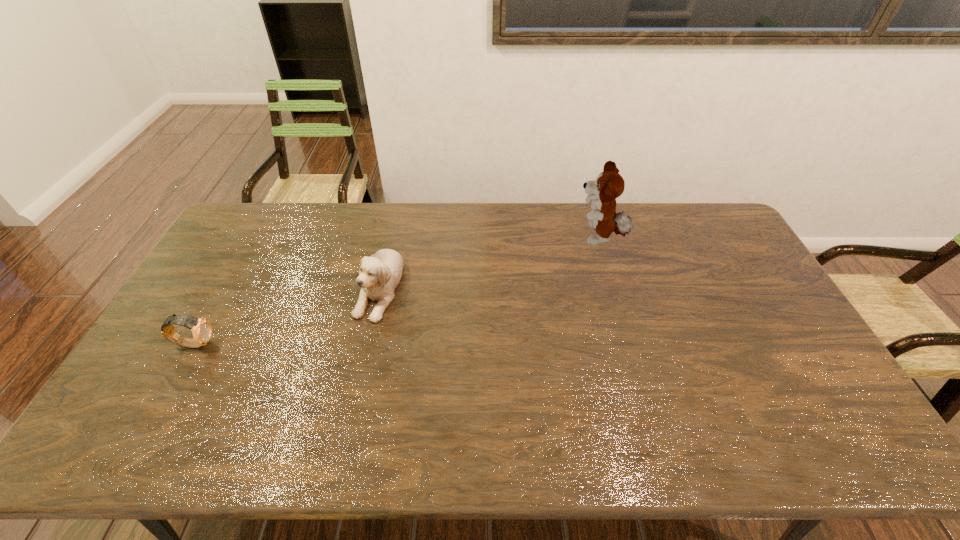
Find the location of a particular element. blank space located on the face of the leftmost object is located at coordinates (x=356, y=343).

Image resolution: width=960 pixels, height=540 pixels. I want to click on object that is at the far edge, so click(x=609, y=185).

At what (x,y) coordinates should I click in order to perform the action: click on object located in the left edge section of the desktop. Please return your answer as a coordinate pair (x, y). The height and width of the screenshot is (540, 960). Looking at the image, I should click on [x=201, y=329].

In the image, there is a desktop. Where is `free region at the far edge`? This screenshot has height=540, width=960. free region at the far edge is located at coordinates (303, 230).

In the image, there is a desktop. In order to click on vacant space at the near edge in this screenshot , I will do coord(204,441).

Identify the location of free region at the left edge of the desktop. (177, 387).

Locate an element on the screen. Image resolution: width=960 pixels, height=540 pixels. vacant space at the right edge of the desktop is located at coordinates (698, 246).

This screenshot has width=960, height=540. In the image, there is a desktop. In order to click on vacant region at the far left corner in this screenshot , I will do `click(246, 218)`.

Identify the location of free region at the near right corner of the desktop. coord(843,432).

This screenshot has height=540, width=960. Find the location of `empty space between the leftmost object and the second shortest object`. empty space between the leftmost object and the second shortest object is located at coordinates (286, 315).